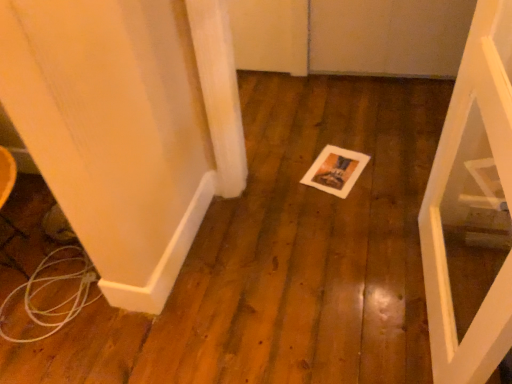
Describe the element at coordinates (473, 211) in the screenshot. The image size is (512, 384). I see `white matte door at center` at that location.

At what (x,y) coordinates should I click in order to perform the action: click on white matte door at center. Please return your answer as a coordinate pair (x, y). Looking at the image, I should click on (473, 211).

Describe the element at coordinates (335, 170) in the screenshot. The image size is (512, 384). I see `white paper at center` at that location.

What is the approximate height of white paper at center?

The height of white paper at center is 1.41 inches.

You are a GUI agent. You are given a task and a screenshot of the screen. Output one action in this format:
    pyautogui.click(x=<x>, y=<y>)
    Task: Click on the white paper at center
    The height and width of the screenshot is (384, 512).
    Given the screenshot: What is the action you would take?
    pyautogui.click(x=335, y=170)

Identify the location of white matte door at center. (473, 211).

Is white paper at center to the left of white matte door at center from the viewer's perspective?

Yes.

Looking at this image, which object is further away from the camera taking this photo, white paper at center or white matte door at center?

white paper at center is further from the camera.

Considering the points (334, 164) and (478, 94), which point is in front, point (334, 164) or point (478, 94)?

The point (478, 94) is more forward.

From the image's perspective, is white paper at center above white matte door at center?

Correct, white paper at center appears higher than white matte door at center in the image.

From a real-world perspective, does white paper at center sit lower than white matte door at center?

Yes, from a real-world perspective, white paper at center is under white matte door at center.

Considering the sizes of objects white paper at center and white matte door at center in the image provided, who is wider, white paper at center or white matte door at center?

white paper at center.

Which of these two, white paper at center or white matte door at center, stands shorter?

With less height is white paper at center.

In terms of size, does white paper at center appear bigger or smaller than white matte door at center?

white paper at center is smaller than white matte door at center.

Is white paper at center completely or partially outside of white matte door at center?

Yes.

From the picture: Is white paper at center far away from white matte door at center?

No, white paper at center is not far away from white matte door at center.

Is white paper at center oriented away from white matte door at center?

No.

What's the angular difference between white paper at center and white matte door at center's facing directions?

There is a 71.7-degree angle between the facing directions of white paper at center and white matte door at center.

Find the location of a particular element. The image size is (512, 384). door in front of the white paper at center is located at coordinates (473, 211).

Considering the positions of objects white matte door at center and white paper at center in the image provided, who is more to the right, white matte door at center or white paper at center?

white matte door at center is more to the right.

Is white matte door at center positioned before white paper at center?

That is True.

Between point (454, 333) and point (335, 160), which one is positioned in front?

The point (454, 333) is more forward.

From the image's perspective, between white matte door at center and white paper at center, which one is located above?

white paper at center is shown above in the image.

Consider the image. From a real-world perspective, which object stands above the other?

In real-world perspective, white matte door at center is above.

Can you confirm if white matte door at center is wider than white paper at center?

No.

Considering the relative sizes of white matte door at center and white paper at center in the image provided, is white matte door at center taller than white paper at center?

Correct, white matte door at center is much taller as white paper at center.

Can you confirm if white matte door at center is smaller than white paper at center?

Incorrect, white matte door at center is not smaller in size than white paper at center.

Is white paper at center inside white matte door at center?

No, white matte door at center does not contain white paper at center.

Are white matte door at center and white paper at center far apart?

white matte door at center is near white paper at center, not far away.

Is white paper at center at the back of white matte door at center?

No, white paper at center is not at the back of white matte door at center.

Can you tell me how much white matte door at center and white paper at center differ in facing direction?

71.7 degrees.

In order to click on door above the white paper at center (from a real-world perspective) in this screenshot , I will do `click(473, 211)`.

This screenshot has height=384, width=512. What are the coordinates of `door located below the white paper at center (from the image's perspective)` in the screenshot? It's located at (473, 211).

Image resolution: width=512 pixels, height=384 pixels. Identify the location of door that appears in front of the white paper at center. (473, 211).